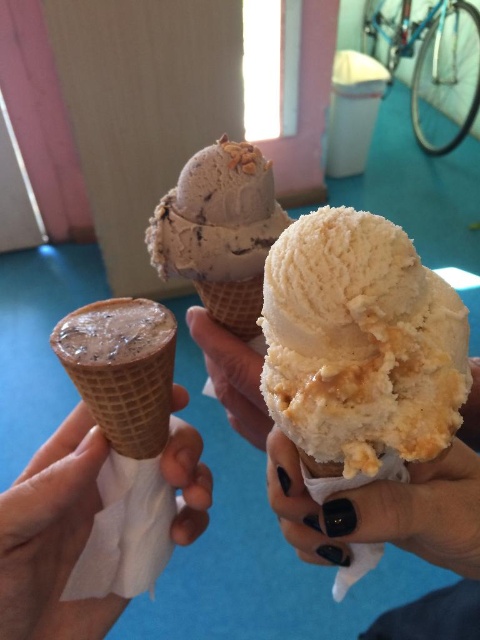
Question: Is vanilla ice cream at center to the left of chocolate chip ice cream at center from the viewer's perspective?

Choices:
 (A) yes
 (B) no

Answer: (B)

Question: Which of the following is the closest to the observer?

Choices:
 (A) 272,397
 (B) 81,426

Answer: (A)

Question: Which object is closer to the camera taking this photo?

Choices:
 (A) vanilla ice cream at center
 (B) chocolate chip ice cream at center
 (C) black nail polish at center

Answer: (A)

Question: Considering the relative positions of vanilla ice cream at center and chocolate waffle cone at left in the image provided, where is vanilla ice cream at center located with respect to chocolate waffle cone at left?

Choices:
 (A) below
 (B) above

Answer: (B)

Question: From the image, what is the correct spatial relationship of vanilla ice cream at center in relation to brown waffle cone at center?

Choices:
 (A) left
 (B) right

Answer: (B)

Question: Among these points, which one is nearest to the camera?

Choices:
 (A) (194, 214)
 (B) (289, 531)
 (C) (45, 445)

Answer: (B)